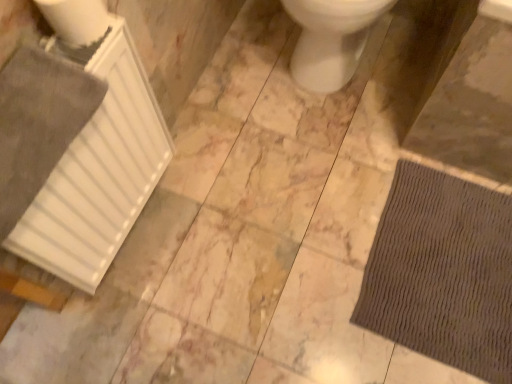
Question: Considering the relative sizes of white matte radiator at left and brown textured mat at lower right in the image provided, is white matte radiator at left wider than brown textured mat at lower right?

Choices:
 (A) yes
 (B) no

Answer: (B)

Question: Is white matte radiator at left with brown textured mat at lower right?

Choices:
 (A) yes
 (B) no

Answer: (B)

Question: From the image's perspective, does white matte radiator at left appear lower than brown textured mat at lower right?

Choices:
 (A) yes
 (B) no

Answer: (B)

Question: From a real-world perspective, is white matte radiator at left physically below brown textured mat at lower right?

Choices:
 (A) no
 (B) yes

Answer: (A)

Question: Is white matte radiator at left oriented towards brown textured mat at lower right?

Choices:
 (A) no
 (B) yes

Answer: (B)

Question: Is white matte radiator at left wider or thinner than brown textured mat at lower right?

Choices:
 (A) wide
 (B) thin

Answer: (B)

Question: Would you say white matte radiator at left is to the left or to the right of brown textured mat at lower right in the picture?

Choices:
 (A) right
 (B) left

Answer: (B)

Question: Is white matte radiator at left situated inside brown textured mat at lower right or outside?

Choices:
 (A) outside
 (B) inside

Answer: (A)

Question: From the image's perspective, is white matte radiator at left positioned above or below brown textured mat at lower right?

Choices:
 (A) above
 (B) below

Answer: (A)

Question: Is white glossy toilet at center bigger or smaller than white matte radiator at left?

Choices:
 (A) small
 (B) big

Answer: (B)

Question: In terms of width, does white glossy toilet at center look wider or thinner when compared to white matte radiator at left?

Choices:
 (A) wide
 (B) thin

Answer: (A)

Question: From the image's perspective, relative to white matte radiator at left, is white glossy toilet at center above or below?

Choices:
 (A) above
 (B) below

Answer: (A)

Question: From a real-world perspective, is white glossy toilet at center positioned above or below white matte radiator at left?

Choices:
 (A) above
 (B) below

Answer: (B)

Question: From their relative heights in the image, would you say brown textured mat at lower right is taller or shorter than white glossy toilet at center?

Choices:
 (A) tall
 (B) short

Answer: (B)

Question: Does point (406, 294) appear closer or farther from the camera than point (302, 23)?

Choices:
 (A) farther
 (B) closer

Answer: (B)